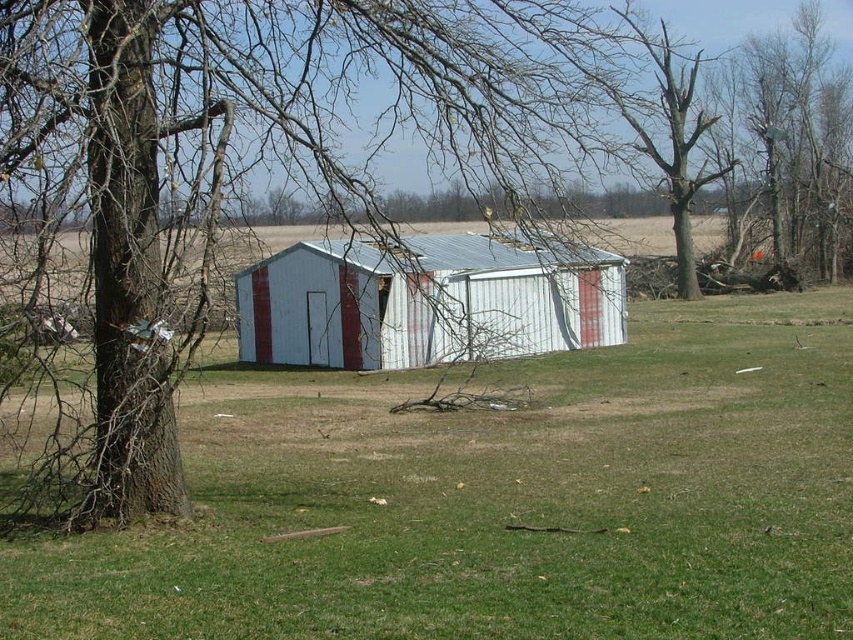
You are a gardener who wants to plant flowers in the green grass at center. Since the white corrugated metal shed at center is in the way, can you move it to make space?

The green grass at center is positioned under the white corrugated metal shed at center, so you cannot plant flowers there without moving the shed first.

You are a farmer checking the field. You notice the brown bark tree at left and the green grass at center. Which one has a larger width?

The brown bark tree at left might be wider than green grass at center.